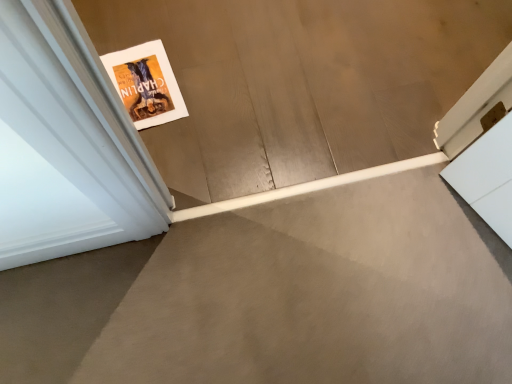
Question: Should I look upward or downward to see white matte book at lower left?

Choices:
 (A) down
 (B) up

Answer: (B)